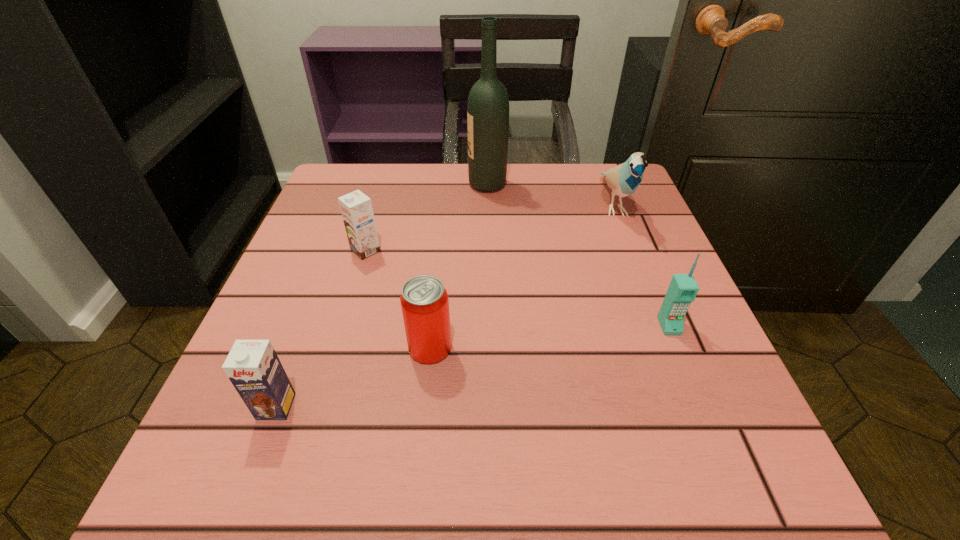
Image resolution: width=960 pixels, height=540 pixels. What are the coordinates of `blank space located 0.220m on the labeled side of the wine bottle` in the screenshot? It's located at (376, 185).

The height and width of the screenshot is (540, 960). I want to click on vacant space situated on the labeled side of the wine bottle, so click(x=427, y=185).

The height and width of the screenshot is (540, 960). In order to click on vacant space located 0.140m at the face of the fifth shortest object in this screenshot , I will do `click(645, 284)`.

Where is `free region located on the keypad of the cellular telephone`? The image size is (960, 540). free region located on the keypad of the cellular telephone is located at coordinates (690, 377).

This screenshot has height=540, width=960. In order to click on vacant area situated on the back of the can in this screenshot , I will do `click(445, 200)`.

Where is `blank area located on the front of the right chocolate milk`? blank area located on the front of the right chocolate milk is located at coordinates (334, 357).

Where is `free space located 0.080m on the front label of the leftmost object`? free space located 0.080m on the front label of the leftmost object is located at coordinates (249, 479).

In order to click on wine bottle situated at the far edge in this screenshot , I will do `click(488, 104)`.

I want to click on bird situated at the far edge, so click(x=624, y=179).

The width and height of the screenshot is (960, 540). I want to click on bird that is positioned at the right edge, so click(624, 179).